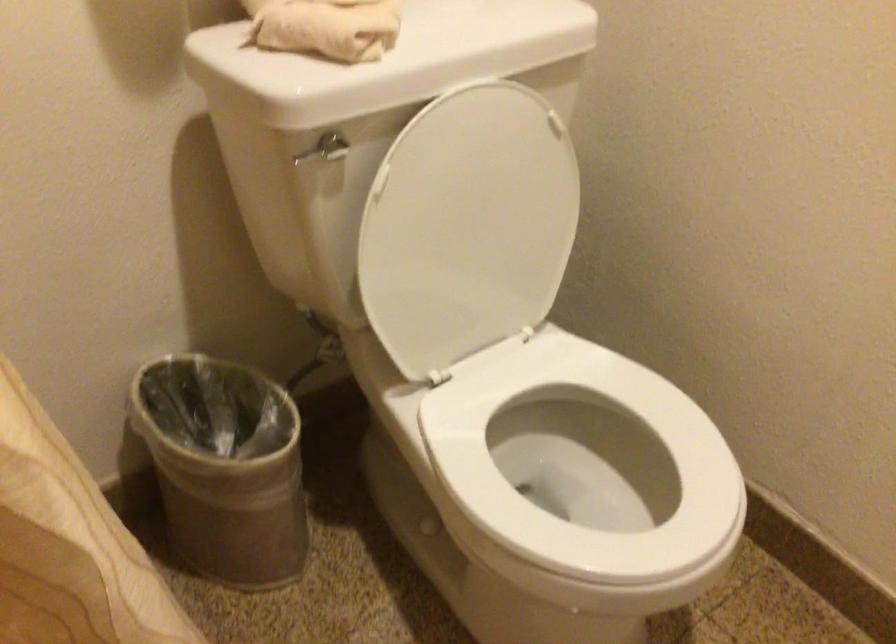
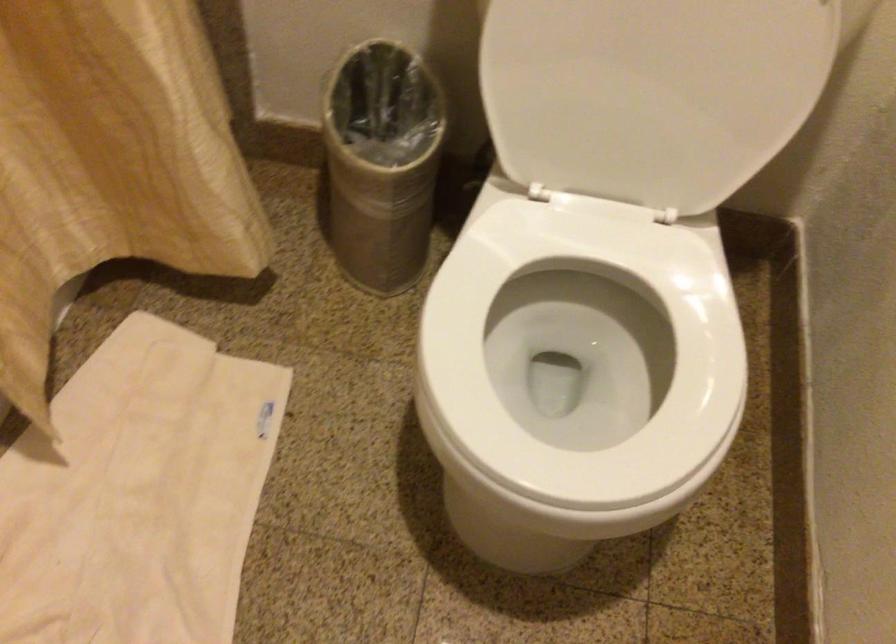
The first image is from the beginning of the video and the second image is from the end. How did the camera likely rotate when shooting the video?

The camera's rotation is toward left-down.